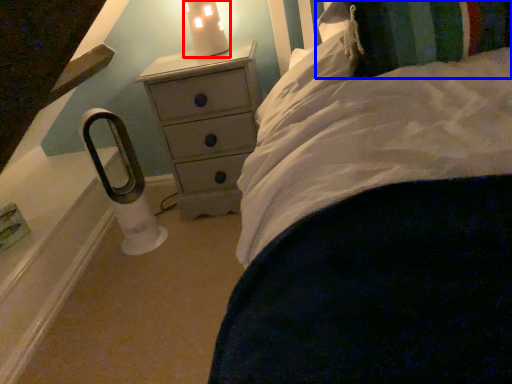
Question: Among these objects, which one is farthest to the camera, candle holder (highlighted by a red box) or pillow (highlighted by a blue box)?

Choices:
 (A) candle holder
 (B) pillow

Answer: (A)